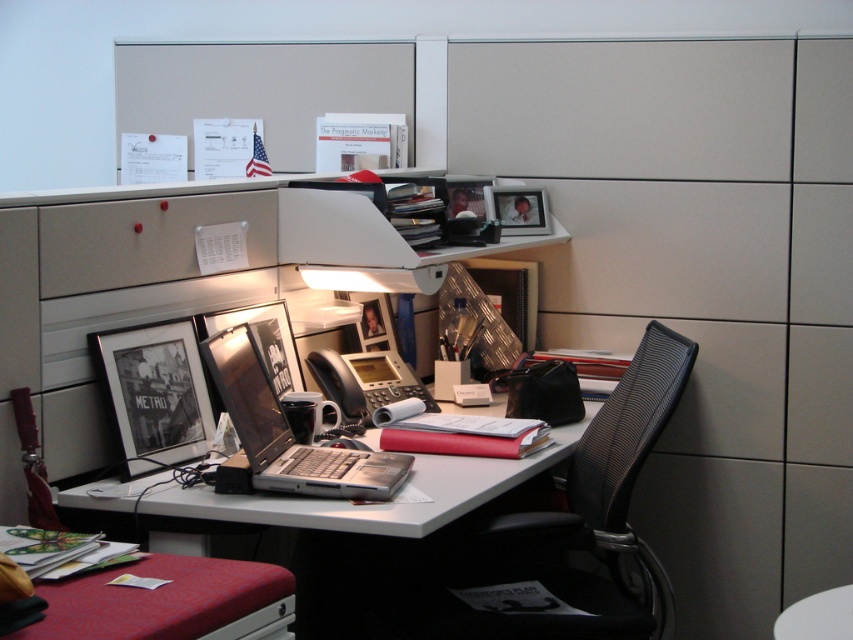
You are an office worker trying to organize your desk. You notice two laptops on your desk labeled as the metallic silver laptop at center and the silver metallic laptop at center. Which one is closer to you?

The metallic silver laptop at center is closer to you because it is in front of the silver metallic laptop at center.

You are organizing the desk and want to stack the metallic silver laptop at center and the metallic silver drawer at lower center vertically. Which one should you place at the bottom to ensure stability?

The metallic silver laptop at center is taller than the metallic silver drawer at lower center, so placing the taller laptop at the bottom would provide better stability.